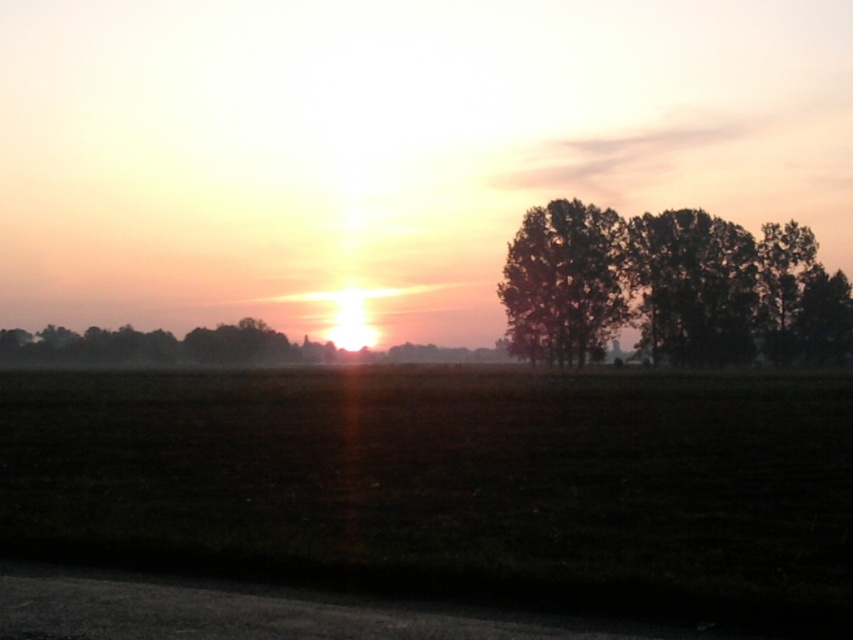
Which is in front, point (4, 449) or point (599, 273)?

Point (4, 449) is more forward.

Is point (831, 616) positioned in front of point (526, 305)?

Yes.

Find the location of `dark soil field at center`. dark soil field at center is located at coordinates (451, 484).

Does silhouette/leafy trees at right have a lesser height compared to silhouette leafy tree at right?

Incorrect, silhouette/leafy trees at right's height does not fall short of silhouette leafy tree at right's.

Can you confirm if silhouette/leafy trees at right is positioned below silhouette leafy tree at right?

Indeed, silhouette/leafy trees at right is positioned under silhouette leafy tree at right.

The width and height of the screenshot is (853, 640). What do you see at coordinates (669, 288) in the screenshot? I see `silhouette/leafy trees at right` at bounding box center [669, 288].

Image resolution: width=853 pixels, height=640 pixels. In order to click on silhouette/leafy trees at right in this screenshot , I will do `click(669, 288)`.

Between dark soil field at center and silhouette/leafy trees at right, which one has more height?

silhouette/leafy trees at right

Can you confirm if dark soil field at center is shorter than silhouette/leafy trees at right?

Indeed, dark soil field at center has a lesser height compared to silhouette/leafy trees at right.

The image size is (853, 640). Describe the element at coordinates (451, 484) in the screenshot. I see `dark soil field at center` at that location.

Locate an element on the screen. This screenshot has width=853, height=640. dark soil field at center is located at coordinates (451, 484).